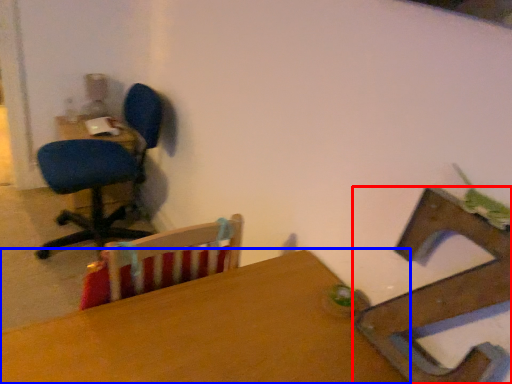
Question: Among these objects, which one is nearest to the camera, chair (highlighted by a red box) or table (highlighted by a blue box)?

Choices:
 (A) chair
 (B) table

Answer: (B)